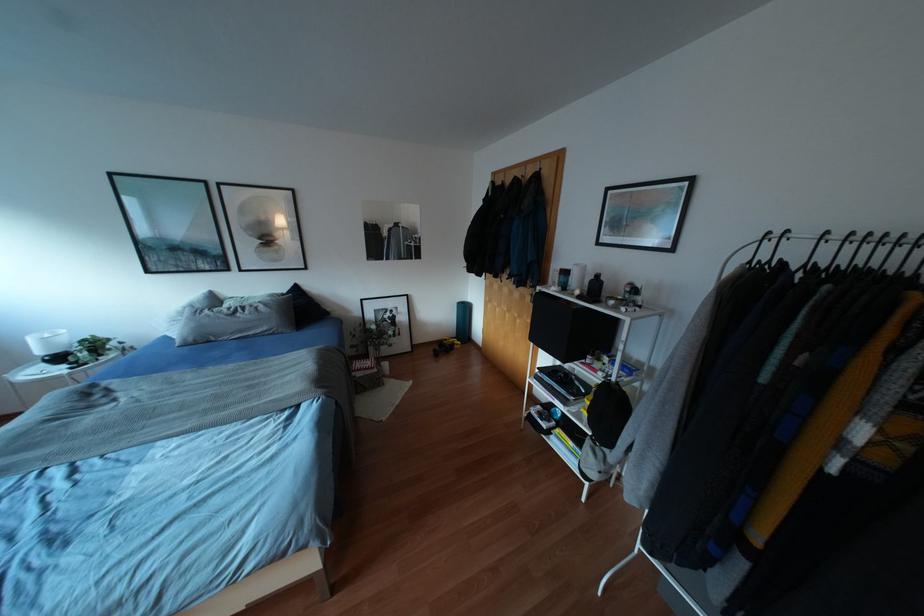
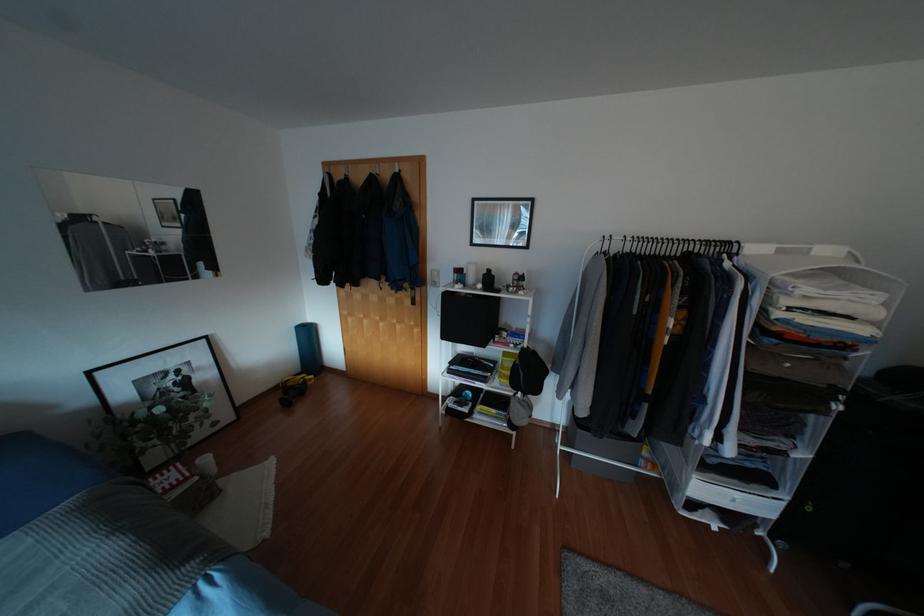
In the second image, find the point that corresponds to (384,363) in the first image.

(205, 459)